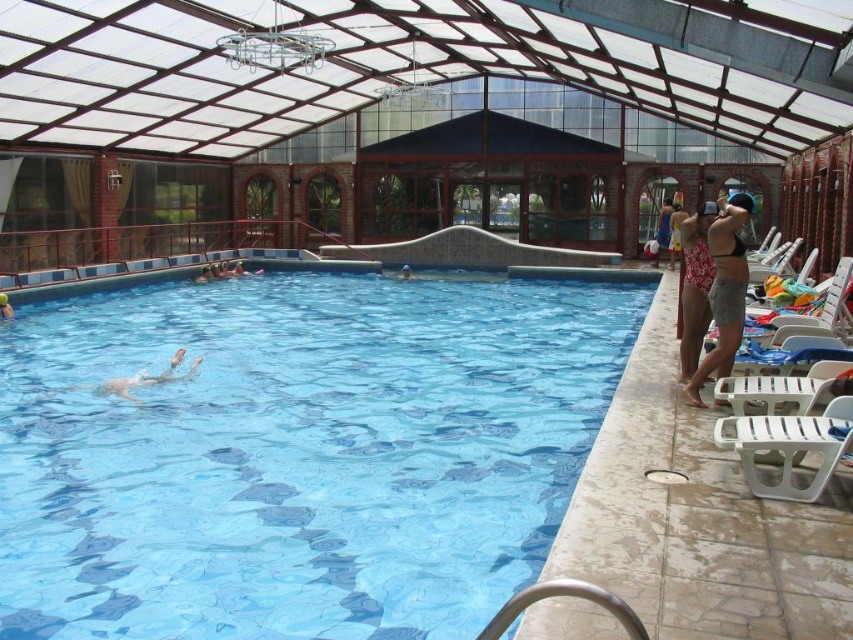
Looking at this image, is white swimsuit at right shorter than smooth skin person at center?

Incorrect, white swimsuit at right's height does not fall short of smooth skin person at center's.

You are a GUI agent. You are given a task and a screenshot of the screen. Output one action in this format:
    pyautogui.click(x=<x>, y=<y>)
    Task: Click on the white swimsuit at right
    This screenshot has width=853, height=640.
    Given the screenshot: What is the action you would take?
    pyautogui.click(x=695, y=285)

At what (x,y) coordinates should I click in order to perform the action: click on white swimsuit at right. Please return your answer as a coordinate pair (x, y). Looking at the image, I should click on (695, 285).

Does blue glossy water at center have a greater width compared to smooth skin person at upper left?

Yes.

Can you confirm if blue glossy water at center is positioned to the right of smooth skin person at upper left?

Indeed, blue glossy water at center is positioned on the right side of smooth skin person at upper left.

Which is behind, point (16, 593) or point (9, 307)?

Positioned behind is point (9, 307).

Image resolution: width=853 pixels, height=640 pixels. Find the location of `blue glossy water at center`. blue glossy water at center is located at coordinates (297, 452).

Between blue glossy water at center and smooth skin person at center, which one is positioned lower?

A: blue glossy water at center is lower down.

Can you confirm if blue glossy water at center is positioned below smooth skin person at center?

Indeed, blue glossy water at center is positioned under smooth skin person at center.

Measure the distance between blue glossy water at center and camera.

15.64 feet

I want to click on blue glossy water at center, so click(297, 452).